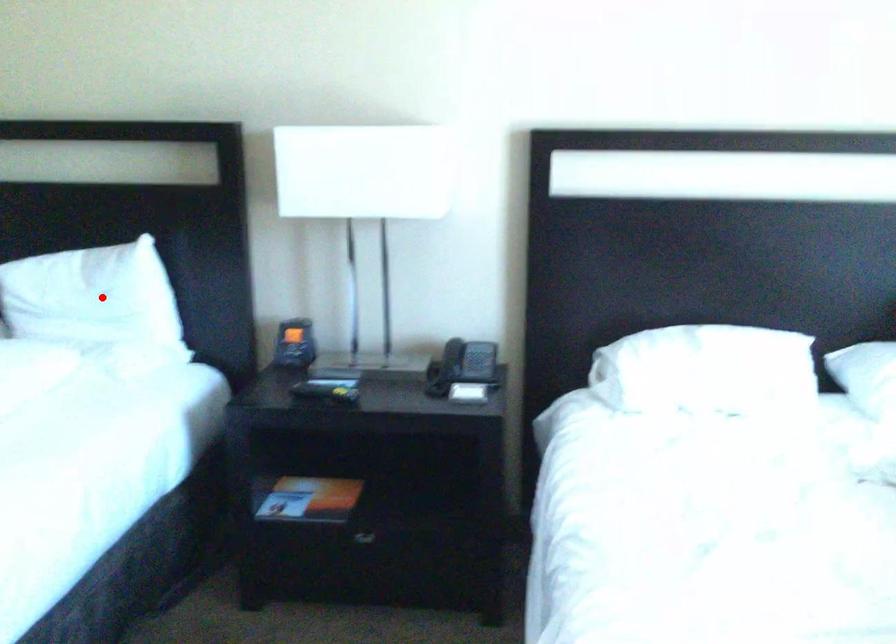
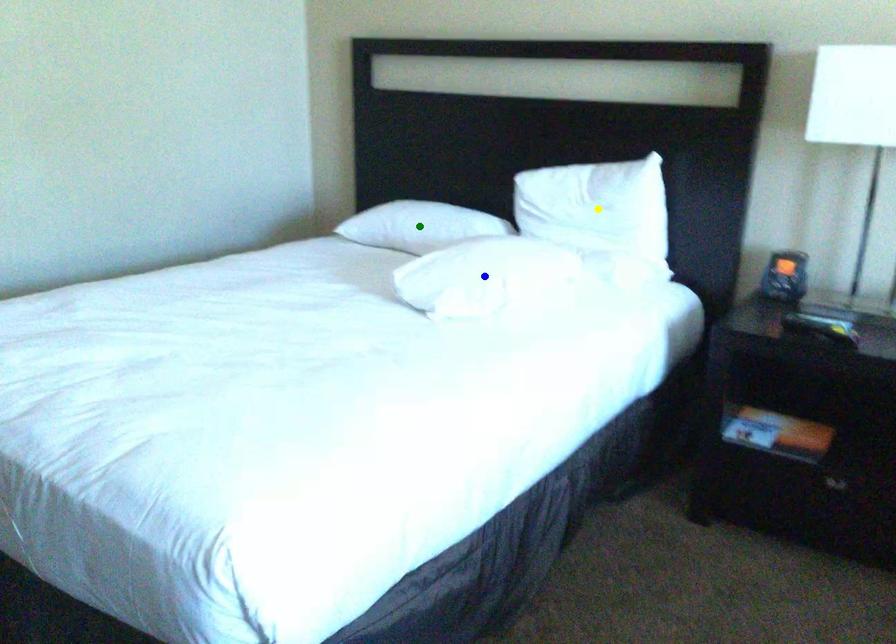
Question: I am providing you with two images of the same scene from different viewpoints. A red point is marked on the first image. You are given multiple points on the second image. Which point in image 2 represents the same 3d spot as the red point in image 1?

Choices:
 (A) yellow point
 (B) green point
 (C) blue point

Answer: (A)